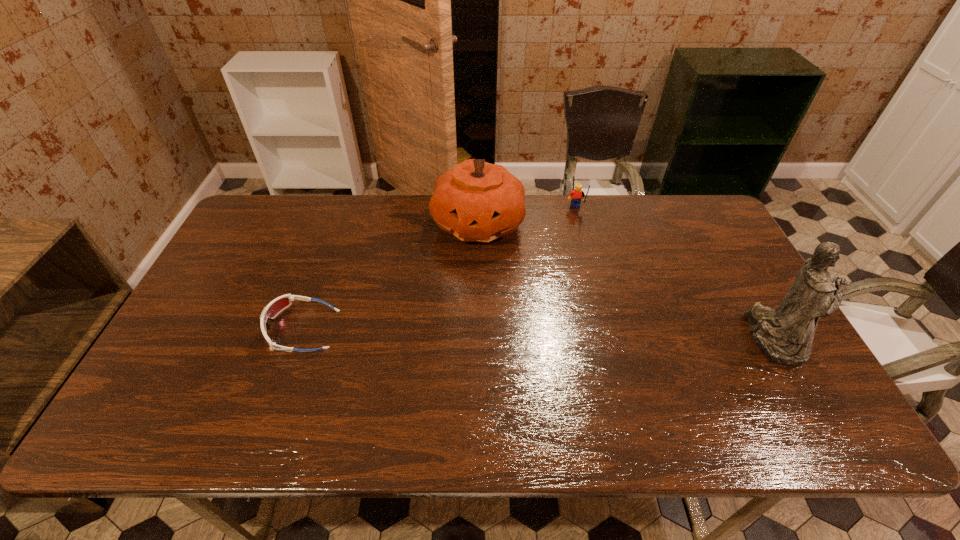
At what (x,y) coordinates should I click in order to perform the action: click on free space on the desktop that is between the leftmost object and the rightmost object and is positioned on the front-facing side of the pumpkin. Please return your answer as a coordinate pair (x, y). Looking at the image, I should click on (519, 334).

Identify the location of free space on the desktop that is between the shortest object and the figurine and is positioned on the front-facing side of the Lego. (596, 335).